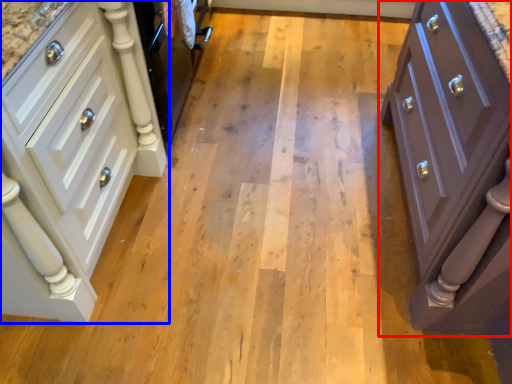
Question: Which point is further to the camera, chest of drawers (highlighted by a red box) or chest of drawers (highlighted by a blue box)?

Choices:
 (A) chest of drawers
 (B) chest of drawers

Answer: (B)